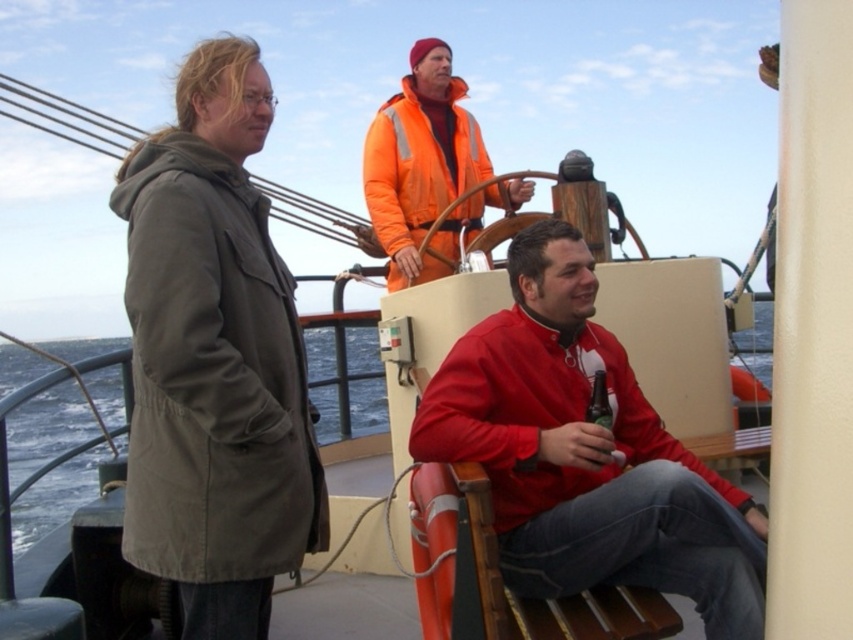
Question: Which point is closer to the camera taking this photo?

Choices:
 (A) (254, 577)
 (B) (596, 420)
 (C) (438, 369)
 (D) (469, 205)

Answer: (A)

Question: Which point is farther to the camera?

Choices:
 (A) (482, 467)
 (B) (296, 541)
 (C) (444, 227)
 (D) (608, 410)

Answer: (C)

Question: Estimate the real-world distances between objects in this image. Which object is closer to the matte red jacket at center?

Choices:
 (A) olive green canvas jacket at left
 (B) orange reflective jacket at upper center

Answer: (A)

Question: Does orange reflective jacket at upper center come behind green matte bottle at lower center?

Choices:
 (A) no
 (B) yes

Answer: (B)

Question: Does olive green canvas jacket at left have a lesser width compared to green matte bottle at lower center?

Choices:
 (A) yes
 (B) no

Answer: (B)

Question: Can you confirm if matte red jacket at center is bigger than green matte bottle at lower center?

Choices:
 (A) no
 (B) yes

Answer: (B)